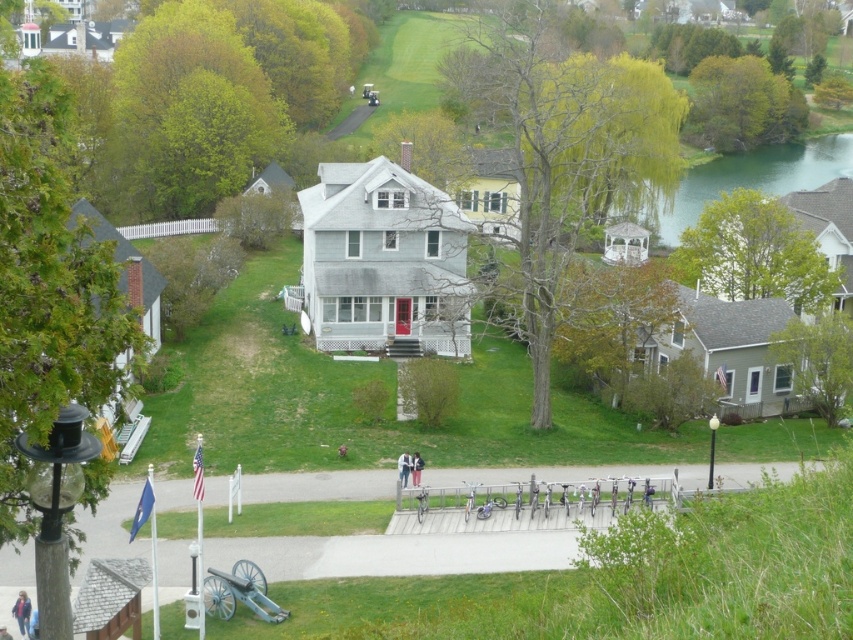
Question: Can you confirm if green water at upper right is positioned below gray metallic cannon at lower center?

Choices:
 (A) yes
 (B) no

Answer: (B)

Question: Which point appears closest to the camera in this image?

Choices:
 (A) (791, 180)
 (B) (206, 600)

Answer: (B)

Question: Does green water at upper right lie in front of gray metallic cannon at lower center?

Choices:
 (A) no
 (B) yes

Answer: (A)

Question: Which of the following is the farthest from the observer?

Choices:
 (A) green water at upper right
 (B) gray metallic cannon at lower center

Answer: (A)

Question: Does green water at upper right come in front of gray metallic cannon at lower center?

Choices:
 (A) yes
 (B) no

Answer: (B)

Question: Which object appears farthest from the camera in this image?

Choices:
 (A) green water at upper right
 (B) gray metallic cannon at lower center

Answer: (A)